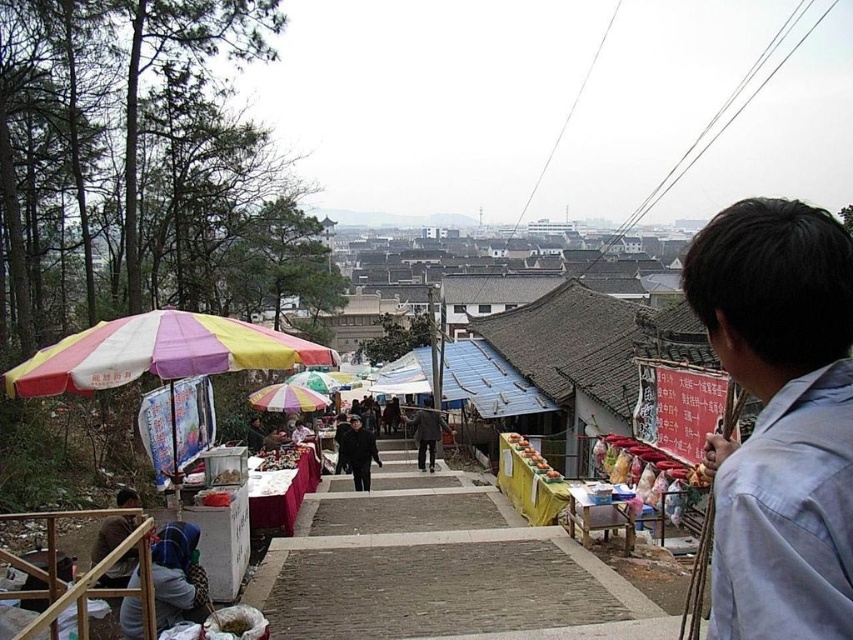
You are a customer at the market and want to buy an umbrella. You see the rainbow fabric umbrella at left and the rainbow striped fabric umbrella at center. Which umbrella is directly above the other?

The rainbow fabric umbrella at left is positioned over the rainbow striped fabric umbrella at center.